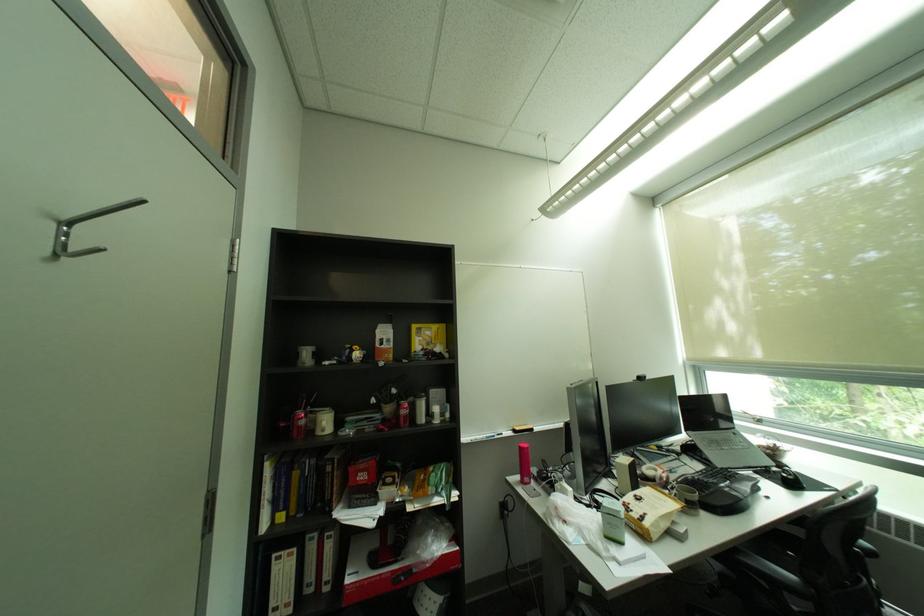
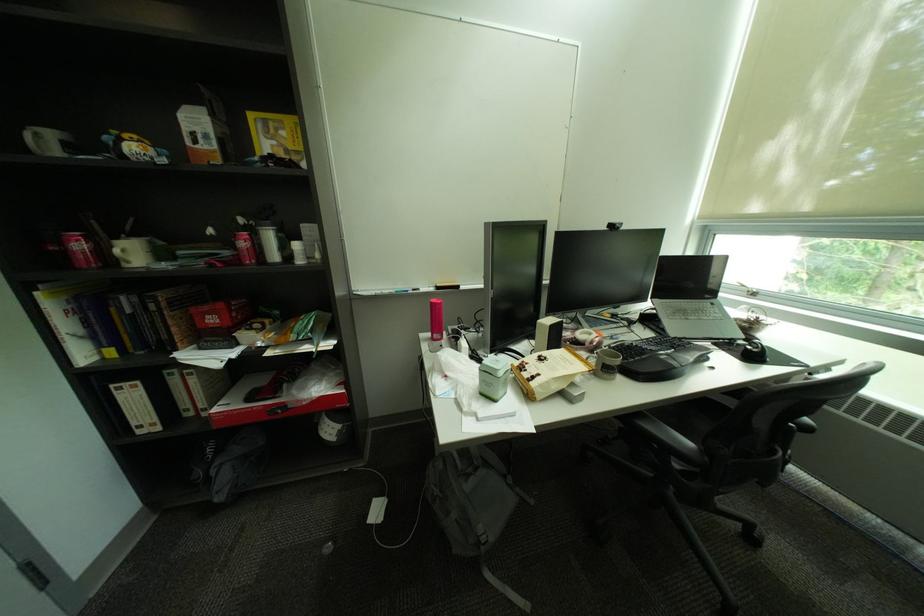
Find the pixel in the second image that matches (517,479) in the first image.

(431, 334)